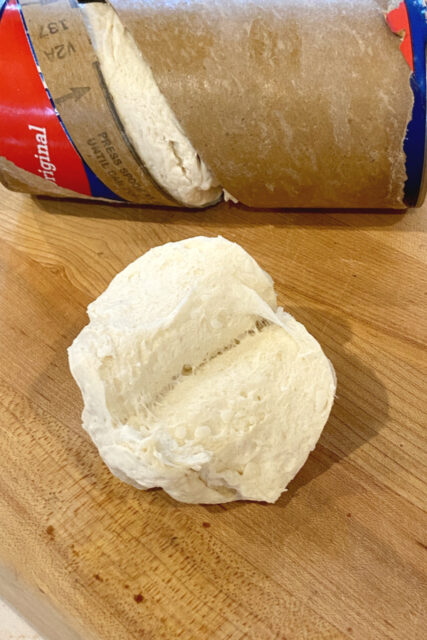
Locate an element on the screen. This screenshot has width=427, height=640. lighter wood of table is located at coordinates (78, 240), (388, 441), (414, 237).